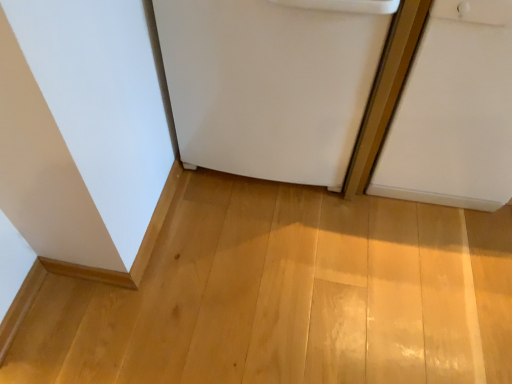
Question: In the image, is white matte door at right positioned in front of or behind white matte refrigerator at center?

Choices:
 (A) front
 (B) behind

Answer: (A)

Question: From the image's perspective, is white matte door at right located above or below white matte refrigerator at center?

Choices:
 (A) below
 (B) above

Answer: (A)

Question: Does point (495, 178) appear closer or farther from the camera than point (308, 180)?

Choices:
 (A) closer
 (B) farther

Answer: (A)

Question: Based on their sizes in the image, would you say white matte refrigerator at center is bigger or smaller than white matte door at right?

Choices:
 (A) big
 (B) small

Answer: (A)

Question: Visually, is white matte refrigerator at center positioned to the left or to the right of white matte door at right?

Choices:
 (A) left
 (B) right

Answer: (A)

Question: Is point (211, 122) positioned closer to the camera than point (478, 92)?

Choices:
 (A) closer
 (B) farther

Answer: (B)

Question: In terms of width, does white matte refrigerator at center look wider or thinner when compared to white matte door at right?

Choices:
 (A) wide
 (B) thin

Answer: (A)